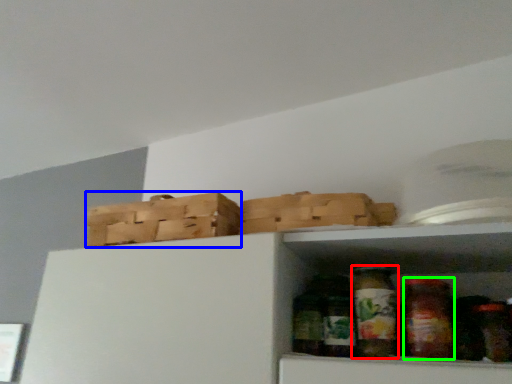
Question: Which is farther away from glass jar (highlighted by a red box)? basket (highlighted by a blue box) or glass jar (highlighted by a green box)?

Choices:
 (A) basket
 (B) glass jar

Answer: (A)